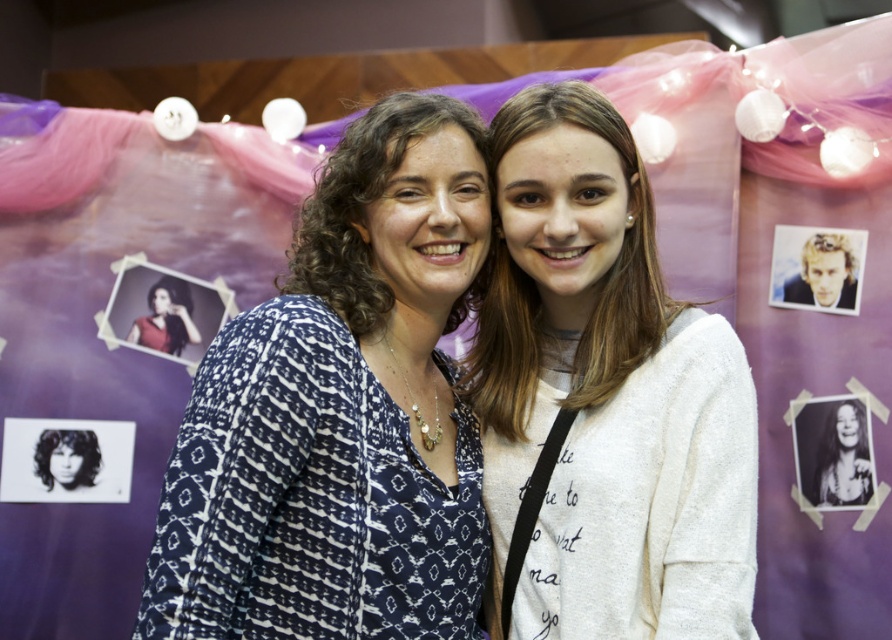
You are a photographer adjusting the lighting for a group photo. You notice the blue printed blouse at center and the black glossy photo at center in the scene. Which object should you focus on to ensure proper exposure since it takes up more space in the frame?

The blue printed blouse at center should be focused on for proper exposure because it has a larger size compared to the black glossy photo at center, making it more prominent in the frame.

You are a photographer who needs to place a 15 cm wide frame on the backdrop. The frame must fit around either the black glossy photo at center or the matte red blouse at center. Which object can the frame accommodate without overlapping?

The matte red blouse at center has a greater width than the black glossy photo at center. Since the frame is 15 cm wide, it can accommodate the matte red blouse at center if its width is at least 15 cm. However, without specific measurements, we can only conclude that the matte red blouse is wider, so it might be a better fit. Please verify the exact dimensions.

You are a photographer setting up for a portrait session. You need to place a small decorative item exactly at the position of the blue printed blouse at center in the image. What are the coordinates where you should place it?

The coordinates for placing the decorative item should be at point (341, 412), as that is where the blue printed blouse at center is located.